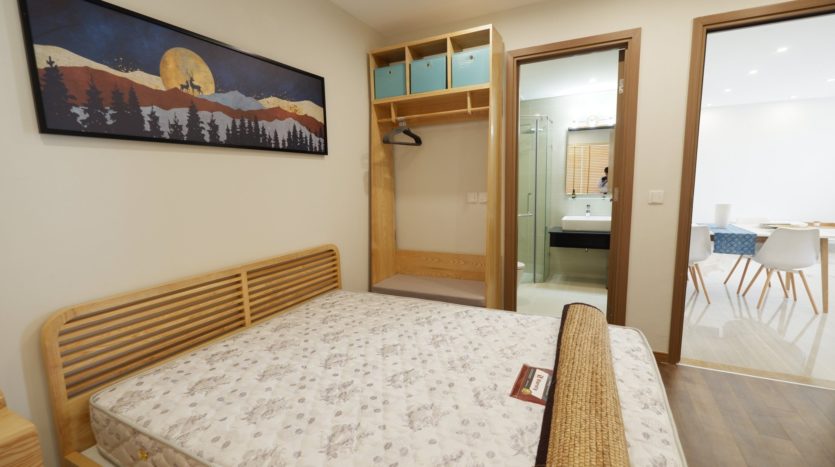
Find the location of a particular element. The image size is (835, 467). wood tone floor is located at coordinates (697, 396).